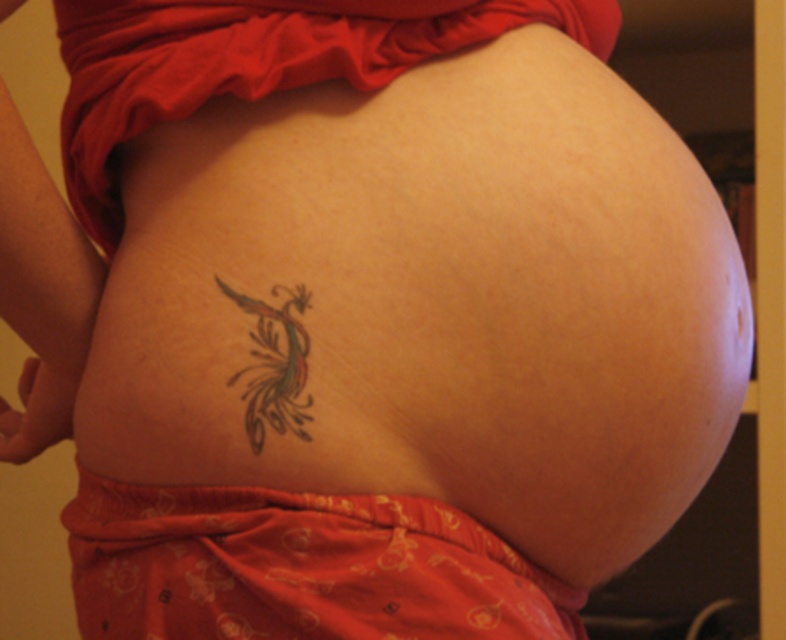
You are a fashion designer examining a client wearing a new outfit. The client has a tattoo that needs to be partially covered by the clothing. Based on the image provided, will the matte orange fabric at lower center cover the multicolored ink dragon at lower center?

The matte orange fabric at lower center is in front of the multicolored ink dragon at lower center, so yes, the fabric will cover the tattoo.

You are a tailor measuring the space between two items on a person. The items are the matte orange fabric at lower center and the multicolored ink dragon at lower center. Which item is wider?

The matte orange fabric at lower center might be wider than the multicolored ink dragon at lower center, so the matte orange fabric at lower center is possibly wider.

You are a photographer adjusting your camera settings to capture the matte orange fabric at lower center. The camera has a focal length of 50mm and an aperture of f2.8. To ensure the fabric is in sharp focus, what distance should you set the focus ring to?

The matte orange fabric at lower center is 20.43 inches from camera, so you should set the focus ring to 20.43 inches to ensure it is in sharp focus.